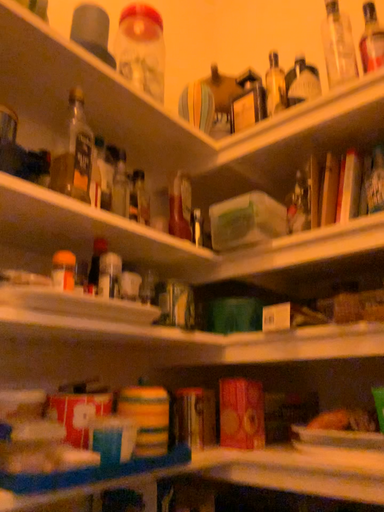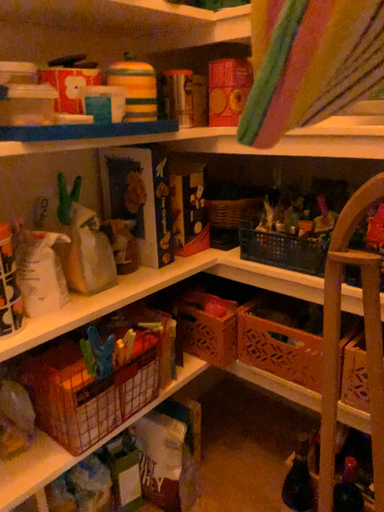
Question: How did the camera likely rotate when shooting the video?

Choices:
 (A) rotated downward
 (B) rotated upward

Answer: (A)